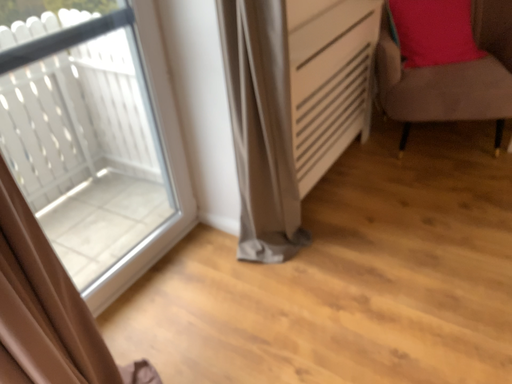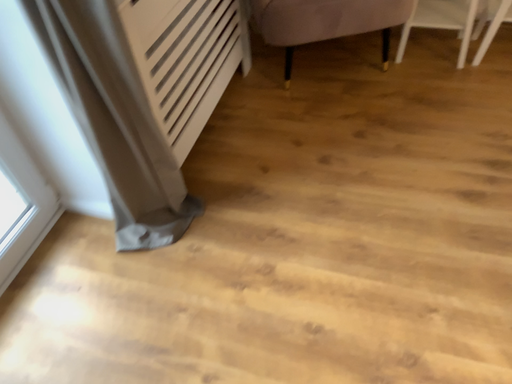
Question: How did the camera likely rotate when shooting the video?

Choices:
 (A) rotated left
 (B) rotated right

Answer: (B)